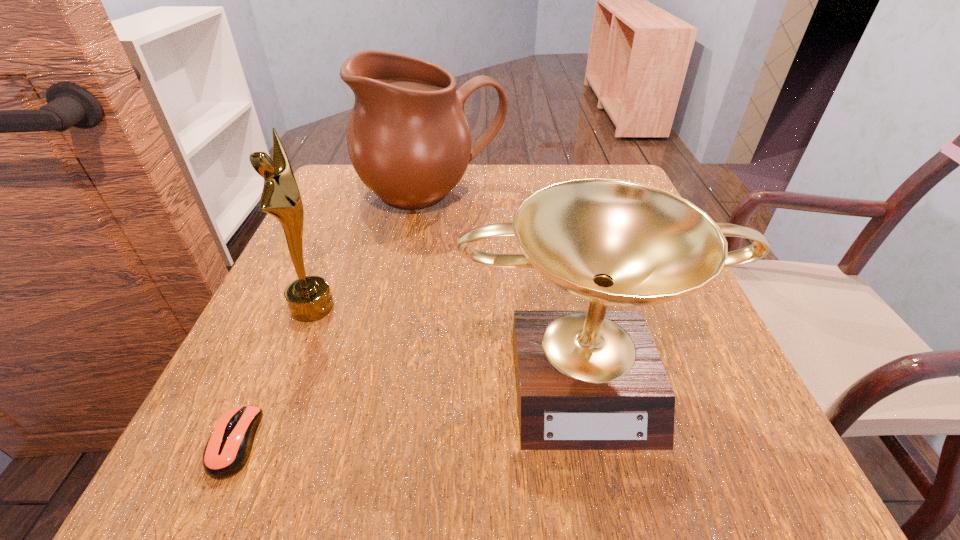
Identify the location of the farthest object. (408, 139).

This screenshot has height=540, width=960. In order to click on the left award in this screenshot , I will do `click(309, 298)`.

This screenshot has height=540, width=960. In order to click on the right award in this screenshot , I will do `click(585, 380)`.

The height and width of the screenshot is (540, 960). Identify the location of computer mouse. (228, 448).

At what (x,y) coordinates should I click in order to perform the action: click on blank space located 0.150m at the spout of the cream pitcher. Please return your answer as a coordinate pair (x, y). The image size is (960, 540). Looking at the image, I should click on (420, 271).

Locate an element on the screen. vacant space situated on the front-facing side of the left award is located at coordinates (468, 307).

At what (x,y) coordinates should I click in order to perform the action: click on free region located 0.060m on the front-facing side of the right award. Please return your answer as a coordinate pair (x, y). Image resolution: width=960 pixels, height=540 pixels. Looking at the image, I should click on (611, 496).

The image size is (960, 540). In order to click on free region located 0.360m on the back of the shortest object in this screenshot , I will do `click(319, 254)`.

Where is `object positioned at the far edge`? The height and width of the screenshot is (540, 960). object positioned at the far edge is located at coordinates (408, 139).

Where is `award located at the near edge`? The width and height of the screenshot is (960, 540). award located at the near edge is located at coordinates (585, 380).